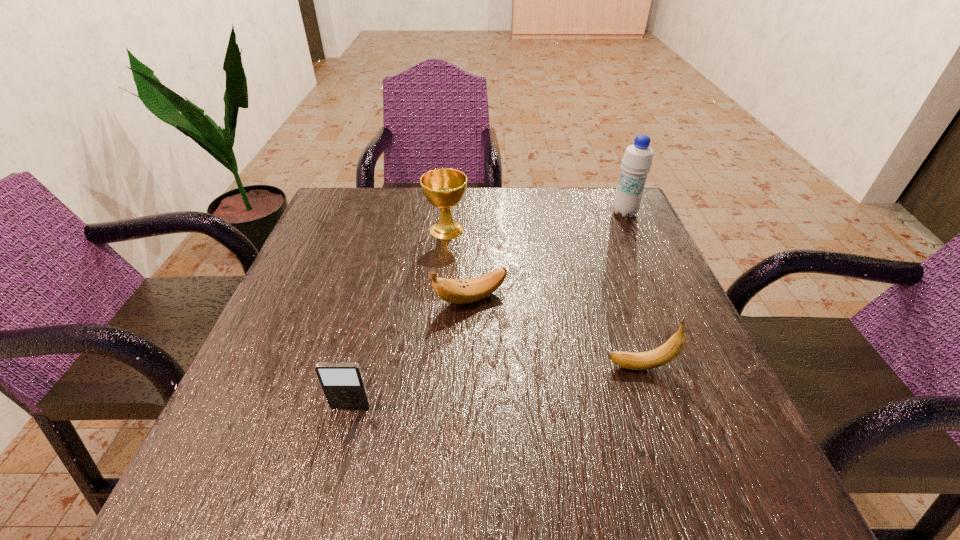
Identify the location of vacant area between the right banana and the chalice. point(543,298).

Where is `vacant space in between the second nearest object and the water bottle`? vacant space in between the second nearest object and the water bottle is located at coordinates (633, 290).

Locate an element on the screen. This screenshot has width=960, height=540. vacant area that lies between the chalice and the iPod is located at coordinates (398, 318).

The image size is (960, 540). In order to click on empty space between the chalice and the leftmost object in this screenshot , I will do `click(398, 318)`.

Image resolution: width=960 pixels, height=540 pixels. Identify the location of free space between the left banana and the leftmost object. (410, 353).

Find the location of a particular element. vacant space in between the tallest object and the farther banana is located at coordinates (547, 256).

The width and height of the screenshot is (960, 540). Find the location of `free space between the fourth farthest object and the nearest object`. free space between the fourth farthest object and the nearest object is located at coordinates (495, 387).

Identify the location of object that stands as the third closest to the leftmost object. (444, 188).

At what (x,y) coordinates should I click in order to perform the action: click on the second closest object to the third nearest object. Please return your answer as a coordinate pair (x, y). Image resolution: width=960 pixels, height=540 pixels. Looking at the image, I should click on (664, 354).

The width and height of the screenshot is (960, 540). I want to click on free point that satisfies the following two spatial constraints: 1. on the front side of the chalice; 2. on the right side of the left banana, so click(x=440, y=299).